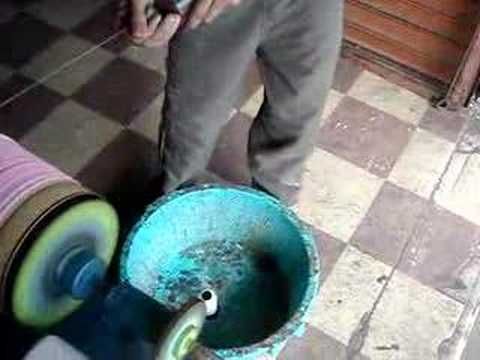
Where is `white tile in fllor`? This screenshot has width=480, height=360. white tile in fllor is located at coordinates (347, 280).